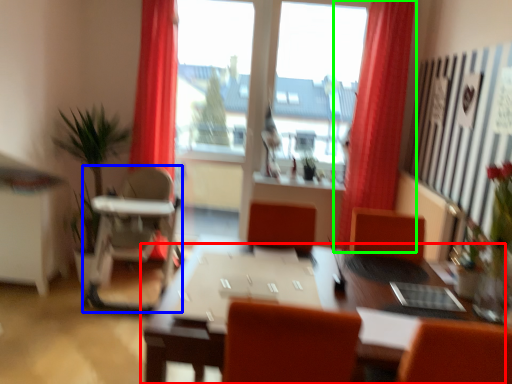
Question: Which object is positioned closest to table (highlighted by a red box)? Select from armchair (highlighted by a blue box) and curtain (highlighted by a green box).

Choices:
 (A) armchair
 (B) curtain

Answer: (B)